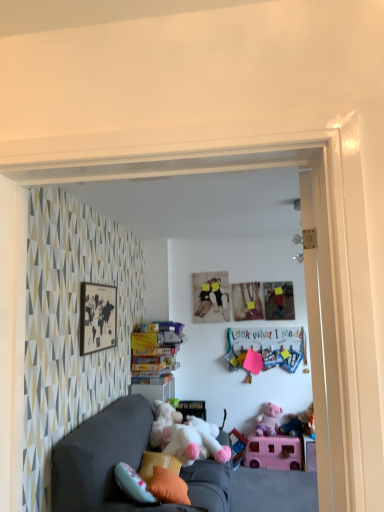
Question: Is orange fabric pillow at lower center, the 2th pillow from the back, not inside orange fabric pillow at lower center, the 1th pillow from the back?

Choices:
 (A) yes
 (B) no

Answer: (A)

Question: Is orange fabric pillow at lower center, the first pillow when ordered from front to back, oriented towards orange fabric pillow at lower center, acting as the second pillow starting from the front?

Choices:
 (A) no
 (B) yes

Answer: (A)

Question: Is orange fabric pillow at lower center, the first pillow when ordered from front to back, thinner than orange fabric pillow at lower center, acting as the second pillow starting from the front?

Choices:
 (A) yes
 (B) no

Answer: (A)

Question: Considering the relative positions of orange fabric pillow at lower center, the first pillow when ordered from front to back, and orange fabric pillow at lower center, the 1th pillow from the back, in the image provided, is orange fabric pillow at lower center, the first pillow when ordered from front to back, to the right of orange fabric pillow at lower center, the 1th pillow from the back, from the viewer's perspective?

Choices:
 (A) no
 (B) yes

Answer: (B)

Question: Is the position of orange fabric pillow at lower center, the first pillow when ordered from front to back, less distant than that of orange fabric pillow at lower center, acting as the second pillow starting from the front?

Choices:
 (A) yes
 (B) no

Answer: (A)

Question: Is the position of orange fabric pillow at lower center, the 2th pillow from the back, more distant than that of orange fabric pillow at lower center, the 1th pillow from the back?

Choices:
 (A) yes
 (B) no

Answer: (B)

Question: Is fluffy pink teddy bear at lower right, which is counted as the second toy, starting from the back, not near matte pink paper at upper center?

Choices:
 (A) yes
 (B) no

Answer: (B)

Question: Can you confirm if fluffy pink teddy bear at lower right, placed as the third toy when sorted from front to back, is shorter than matte pink paper at upper center?

Choices:
 (A) yes
 (B) no

Answer: (A)

Question: Is fluffy pink teddy bear at lower right, placed as the third toy when sorted from front to back, located outside matte pink paper at upper center?

Choices:
 (A) yes
 (B) no

Answer: (A)

Question: Does fluffy pink teddy bear at lower right, placed as the third toy when sorted from front to back, have a larger size compared to matte pink paper at upper center?

Choices:
 (A) no
 (B) yes

Answer: (B)

Question: Is fluffy pink teddy bear at lower right, which is counted as the second toy, starting from the back, at the left side of matte pink paper at upper center?

Choices:
 (A) yes
 (B) no

Answer: (B)

Question: Considering the relative positions of fluffy pink teddy bear at lower right, placed as the third toy when sorted from front to back, and matte pink paper at upper center in the image provided, is fluffy pink teddy bear at lower right, placed as the third toy when sorted from front to back, to the right of matte pink paper at upper center from the viewer's perspective?

Choices:
 (A) yes
 (B) no

Answer: (A)

Question: Is matte pink paper at upper center oriented away from orange fabric pillow at lower center, the 1th pillow from the back?

Choices:
 (A) no
 (B) yes

Answer: (A)